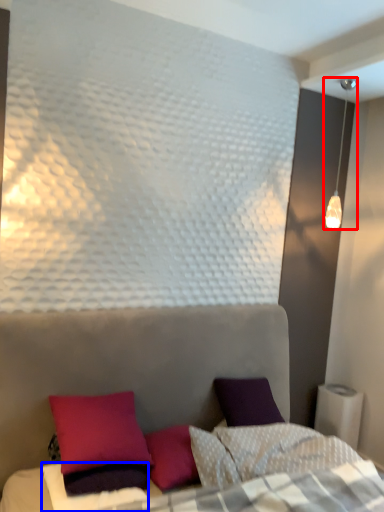
Question: Which point is closer to the camera, lamp (highlighted by a red box) or sheet (highlighted by a blue box)?

Choices:
 (A) lamp
 (B) sheet

Answer: (B)